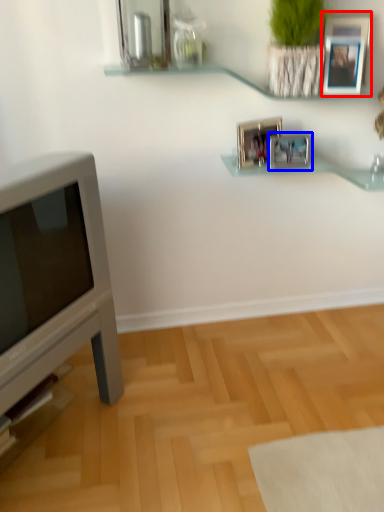
Question: Which of the following is the closest to the observer, picture frame (highlighted by a red box) or picture frame (highlighted by a blue box)?

Choices:
 (A) picture frame
 (B) picture frame

Answer: (A)